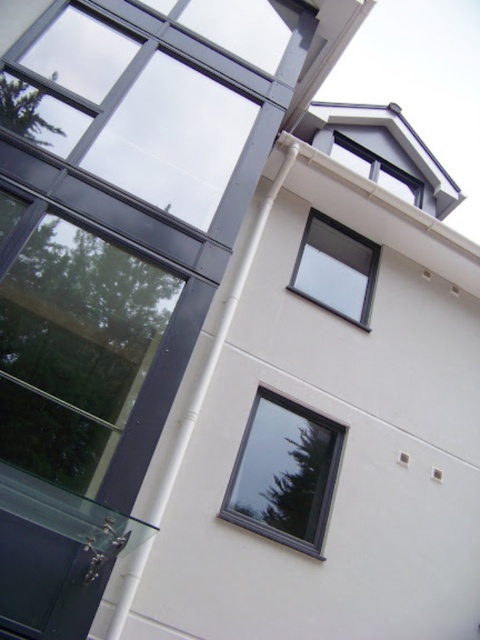
Question: Which of the following is the closest to the observer?

Choices:
 (A) (291, 275)
 (B) (385, 177)

Answer: (A)

Question: Does black glass window at center lie in front of transparent glass window at upper center?

Choices:
 (A) yes
 (B) no

Answer: (A)

Question: In this image, where is black glass window at center located relative to white plastic window at upper right?

Choices:
 (A) left
 (B) right

Answer: (A)

Question: Which object appears closest to the camera in this image?

Choices:
 (A) transparent glass window at upper center
 (B) white plastic window at upper right

Answer: (A)

Question: Which point appears farthest from the camera in this image?

Choices:
 (A) (345, 156)
 (B) (267, 408)
 (C) (330, 262)

Answer: (A)

Question: Considering the relative positions of black glass window at center and white plastic window at upper right in the image provided, where is black glass window at center located with respect to white plastic window at upper right?

Choices:
 (A) above
 (B) below

Answer: (B)